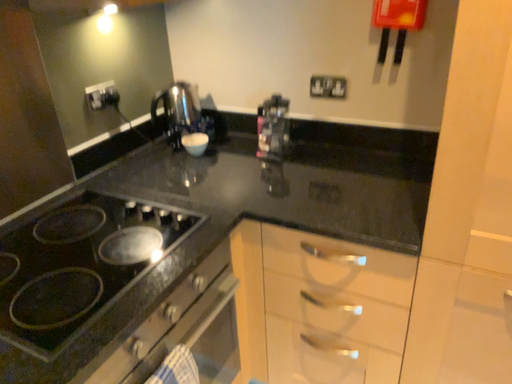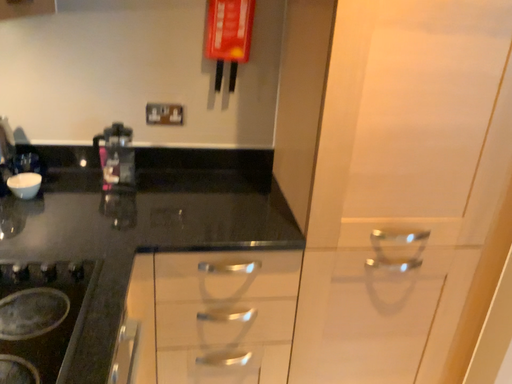
Question: How did the camera likely rotate when shooting the video?

Choices:
 (A) rotated left
 (B) rotated right

Answer: (B)